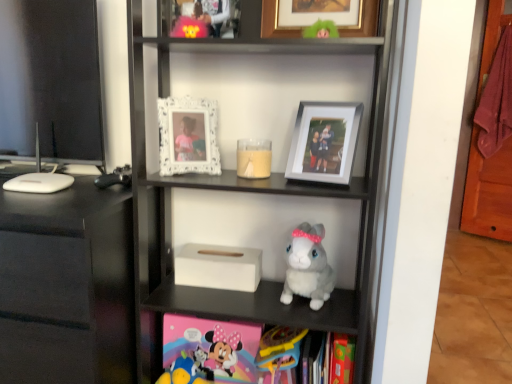
Question: Is matte burgundy towel at right at the left side of white matte tissue box at center?

Choices:
 (A) yes
 (B) no

Answer: (B)

Question: Does matte burgundy towel at right have a larger size compared to white matte tissue box at center?

Choices:
 (A) yes
 (B) no

Answer: (B)

Question: From a real-world perspective, is matte burgundy towel at right under white matte tissue box at center?

Choices:
 (A) yes
 (B) no

Answer: (B)

Question: Can white matte tissue box at center be found inside matte burgundy towel at right?

Choices:
 (A) yes
 (B) no

Answer: (B)

Question: Can you confirm if matte burgundy towel at right is taller than white matte tissue box at center?

Choices:
 (A) no
 (B) yes

Answer: (A)

Question: Is black glossy tv stand at left wider or thinner than soft plush toy at lower center, acting as the 3th toy starting from the right?

Choices:
 (A) wide
 (B) thin

Answer: (A)

Question: From the image's perspective, is black glossy tv stand at left located above or below soft plush toy at lower center, which appears as the 1th toy when viewed from the left?

Choices:
 (A) above
 (B) below

Answer: (A)

Question: In terms of height, does black glossy tv stand at left look taller or shorter compared to soft plush toy at lower center, which appears as the 1th toy when viewed from the left?

Choices:
 (A) tall
 (B) short

Answer: (A)

Question: From a real-world perspective, is black glossy tv stand at left physically located above or below soft plush toy at lower center, which appears as the 1th toy when viewed from the left?

Choices:
 (A) below
 (B) above

Answer: (B)

Question: Looking at the image, does plastic yellow toy at lower center, marked as the 2th toy in a left-to-right arrangement, seem bigger or smaller compared to white glossy computer monitor at left?

Choices:
 (A) small
 (B) big

Answer: (A)

Question: Is plastic yellow toy at lower center, marked as the 2th toy in a left-to-right arrangement, taller or shorter than white glossy computer monitor at left?

Choices:
 (A) short
 (B) tall

Answer: (A)

Question: From the image's perspective, is plastic yellow toy at lower center, marked as the 2th toy in a left-to-right arrangement, located above or below white glossy computer monitor at left?

Choices:
 (A) above
 (B) below

Answer: (B)

Question: From a real-world perspective, is plastic yellow toy at lower center, marked as the 2th toy in a left-to-right arrangement, physically located above or below white glossy computer monitor at left?

Choices:
 (A) above
 (B) below

Answer: (B)

Question: Is white glossy computer monitor at left to the left or to the right of white matte tissue box at center in the image?

Choices:
 (A) right
 (B) left

Answer: (B)

Question: From the image's perspective, is white glossy computer monitor at left above or below white matte tissue box at center?

Choices:
 (A) above
 (B) below

Answer: (A)